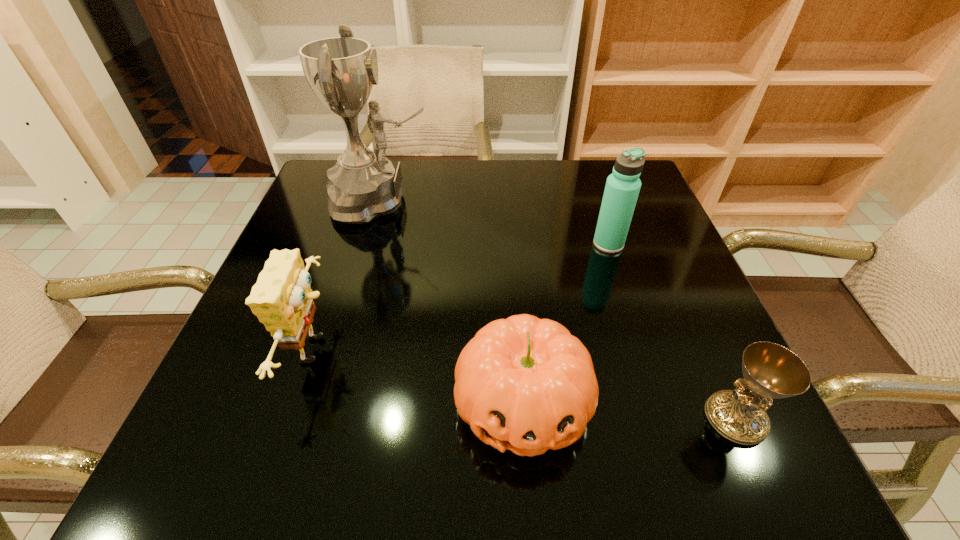
You are a GUI agent. You are given a task and a screenshot of the screen. Output one action in this format:
    pyautogui.click(x=<x>, y=<y>)
    Task: Click on the free space that is in between the sponge and the second tallest object
    This screenshot has height=540, width=960.
    Given the screenshot: What is the action you would take?
    pyautogui.click(x=463, y=297)

Locate an element on the screen. The width and height of the screenshot is (960, 540). vacant area between the thermos bottle and the sponge is located at coordinates (463, 297).

Where is `vacant space that is in between the third tallest object and the thermos bottle`? The image size is (960, 540). vacant space that is in between the third tallest object and the thermos bottle is located at coordinates (463, 297).

Where is `vacant space that's between the sponge and the pumpkin`? vacant space that's between the sponge and the pumpkin is located at coordinates (420, 376).

In order to click on empty location between the award and the thermos bottle in this screenshot , I will do `click(494, 222)`.

Point out which object is positioned as the fourth nearest to the thermos bottle. Please provide its 2D coordinates. Your answer should be formatted as a tuple, i.e. [(x, y)], where the tuple contains the x and y coordinates of a point satisfying the conditions above.

[(282, 297)]

At what (x,y) coordinates should I click in order to perform the action: click on the second closest object to the sponge. Please return your answer as a coordinate pair (x, y). Looking at the image, I should click on (526, 384).

I want to click on free space that satisfies the following two spatial constraints: 1. on the side with emblem of the fourth shortest object; 2. on the left side of the award, so click(x=370, y=244).

Locate an element on the screen. vacant position in the image that satisfies the following two spatial constraints: 1. on the side with emblem of the thermos bottle; 2. on the left side of the tallest object is located at coordinates (370, 244).

Locate an element on the screen. This screenshot has width=960, height=540. vacant area that satisfies the following two spatial constraints: 1. on the carved face of the third object from right to left; 2. on the left side of the rightmost object is located at coordinates (524, 418).